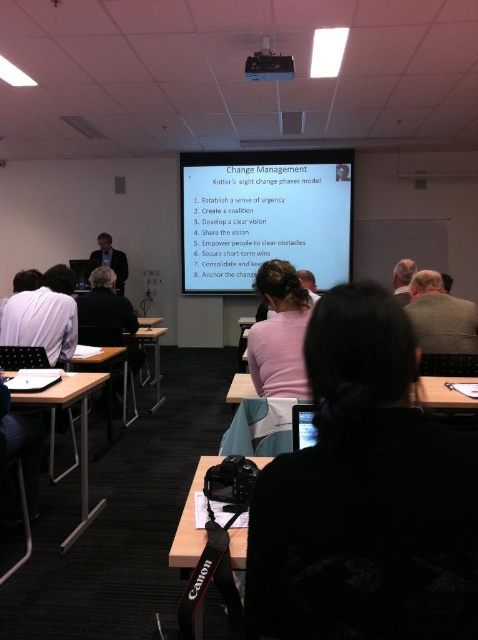
Based on the scene description, can you identify the object located at the coordinates point (365,496)?

The object at point (365,496) is the black fabric at center.

You are a student sitting in the black fabric chair at lower left and want to walk to the white matte projector screen at upper center to ask a question. How many steps do you think you need to take if each step is about 2.5 feet long?

The white matte projector screen at upper center is 11.39 feet away from the black fabric chair at lower left. Since each step is approximately 2.5 feet, dividing 11.39 by 2.5 gives roughly 4.55 steps. Therefore, you would need to take approximately 5 steps to reach the screen.

You are standing at the back of the classroom and want to take a photo of the white matte projector screen at upper center without including the black fabric chair at lower left in the frame. Is this possible based on their positions?

The white matte projector screen at upper center is further to the viewer than the black fabric chair at lower left. Since the screen is closer to you, you can position yourself so that the chair is out of the frame while capturing the screen.